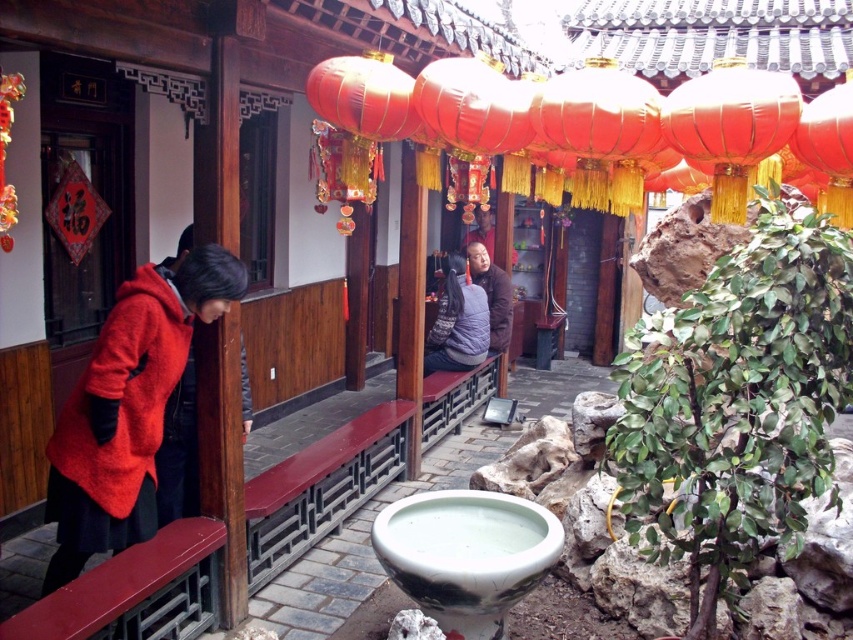
You are planning to hang a new decorative item in the courtyard. You have a choice between placing it above the shiny red lantern at upper center or next to the porcelain basin at center. Considering their sizes, where would you place a small decorative item to ensure it is not overshadowed?

You should place the small decorative item next to the porcelain basin at center because the shiny red lantern at upper center is larger and might make the small item look even smaller in comparison.

You are planning to hang a new decorative item in the courtyard. You have a choice between placing it either above the shiny red lantern at upper center or next to the porcelain basin at center. Considering their widths, which location would allow for a wider decorative item?

The shiny red lantern at upper center has a greater width than the porcelain basin at center, so placing the decorative item above the shiny red lantern at upper center would allow for a wider decorative item.